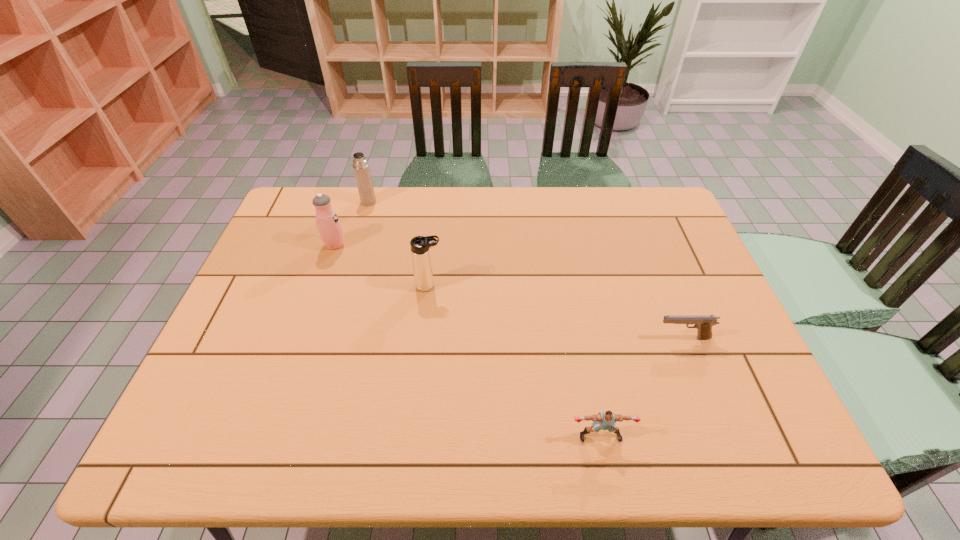
Identify the location of blank area at the near edge. The image size is (960, 540). (394, 439).

Where is `free region at the left edge`? This screenshot has height=540, width=960. free region at the left edge is located at coordinates (257, 377).

Where is `vacant space at the far left corner of the desktop`? This screenshot has width=960, height=540. vacant space at the far left corner of the desktop is located at coordinates (296, 224).

Where is `vacant space at the near left corner of the desktop`? vacant space at the near left corner of the desktop is located at coordinates (218, 448).

In the image, there is a desktop. Identify the location of free space at the far right corner. click(678, 217).

Find the location of a particular element. This screenshot has height=540, width=960. vacant point located between the third nearest object and the shortest object is located at coordinates (556, 312).

Locate an element on the screen. This screenshot has height=540, width=960. vacant space that's between the rightmost thermos bottle and the fourth object from left to right is located at coordinates (515, 361).

Identify the location of free spot between the third object from right to left and the farthest thermos bottle. (399, 244).

Where is `empty space that is in between the nearest object and the second farthest object`? empty space that is in between the nearest object and the second farthest object is located at coordinates (468, 340).

This screenshot has width=960, height=540. I want to click on free spot between the second thermos bottle from right to left and the fourth object from left to right, so click(485, 319).